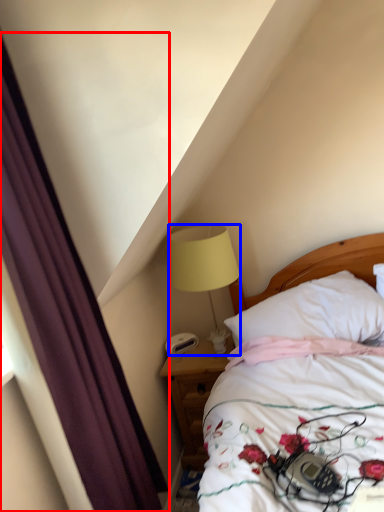
Question: Which object appears closest to the camera in this image, curtain (highlighted by a red box) or lamp (highlighted by a blue box)?

Choices:
 (A) curtain
 (B) lamp

Answer: (A)